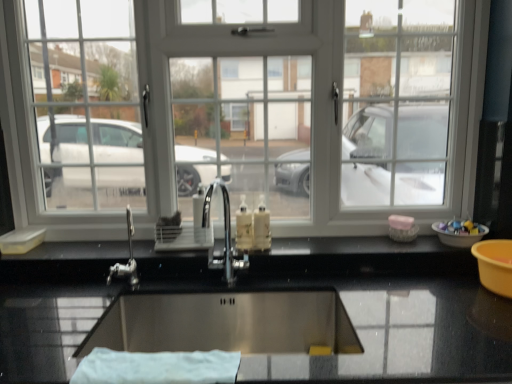
Locate an element on the screen. Image resolution: width=512 pixels, height=384 pixels. vacant point to the right of polished chrome tap at center is located at coordinates (278, 283).